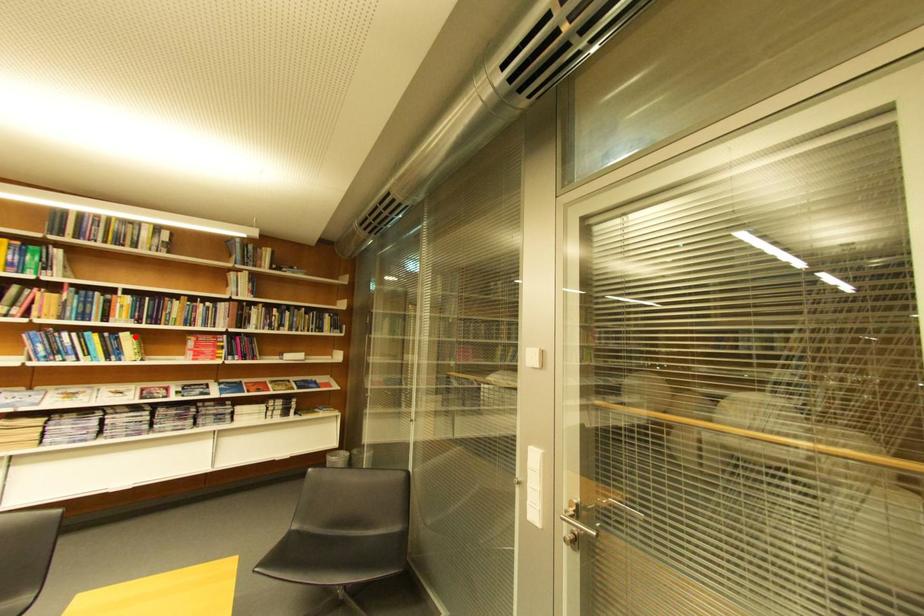
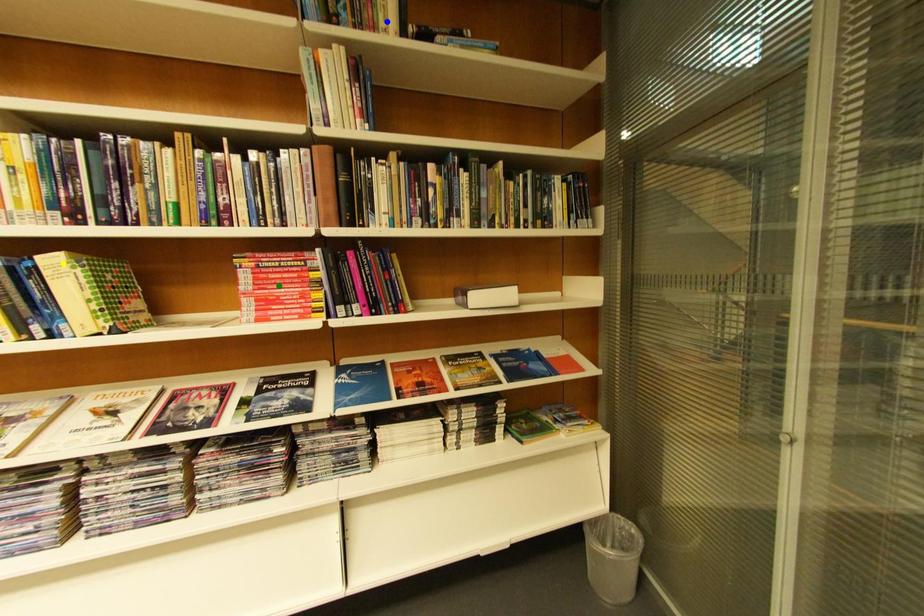
Question: I am providing you with two images of the same scene from different viewpoints. A red point is marked on the first image. You are given multiple points on the second image. Which spot in image 2 lines up with the point in image 1?

Choices:
 (A) green point
 (B) yellow point
 (C) blue point

Answer: (B)